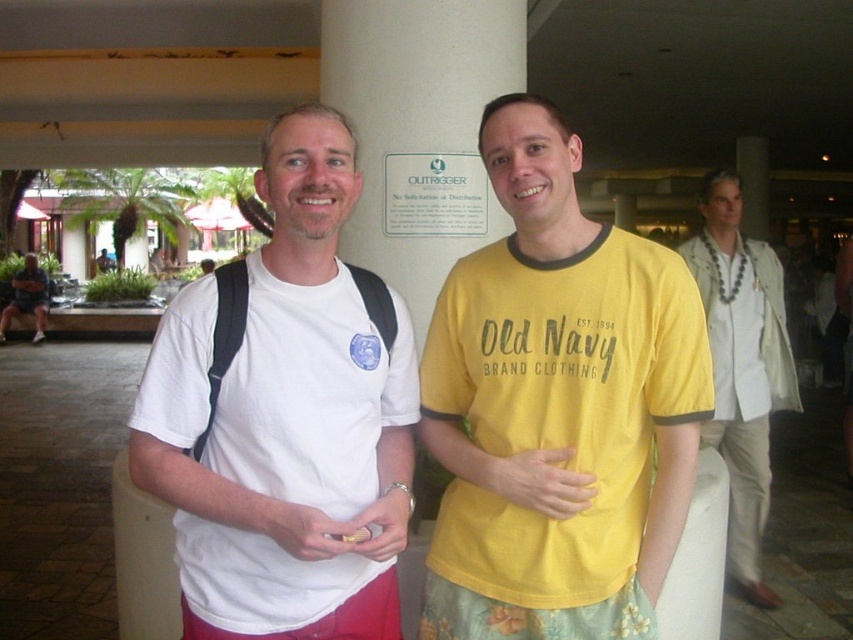
Is white matte t-shirt at center positioned in front of white smooth pillar at center?

That is True.

Measure the distance between point (250,397) and camera.

Point (250,397) and camera are 5.00 feet apart from each other.

This screenshot has height=640, width=853. I want to click on white matte t-shirt at center, so pos(286,420).

Between yellow cotton shirt at center and white smooth pillar at center, which one has more height?

white smooth pillar at center

Which is in front, point (483, 582) or point (479, 109)?

Point (483, 582) is in front.

Find the location of `yellow cotton shirt at center`. yellow cotton shirt at center is located at coordinates (556, 406).

You are a GUI agent. You are given a task and a screenshot of the screen. Output one action in this format:
    pyautogui.click(x=<x>, y=<y>)
    Task: Click on the yellow cotton shirt at center
    
    Given the screenshot: What is the action you would take?
    pyautogui.click(x=556, y=406)

Locate an element on the screen. yellow cotton shirt at center is located at coordinates (556, 406).